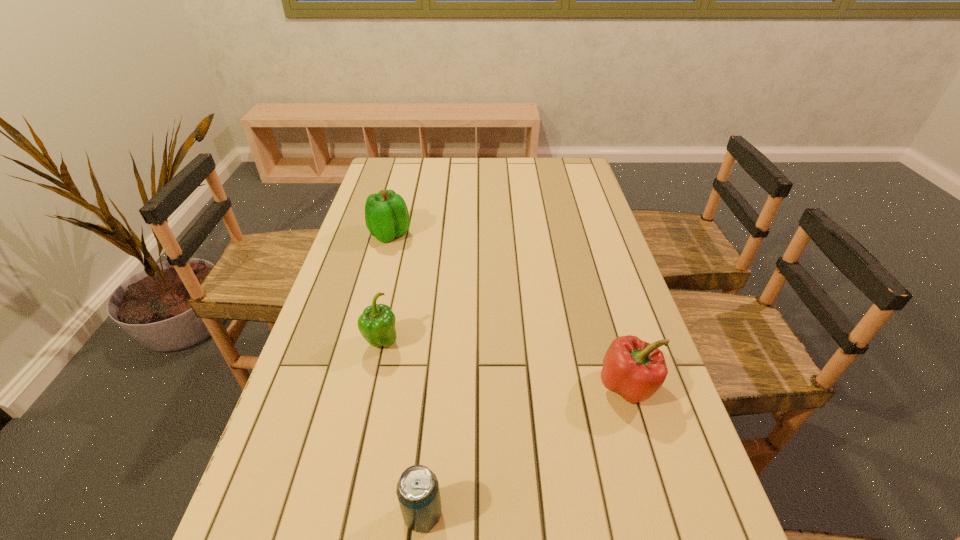
In order to click on vacant point that satisfies the following two spatial constraints: 1. on the back side of the nearest object; 2. on the left side of the rightmost bell pepper in this screenshot , I will do `click(435, 386)`.